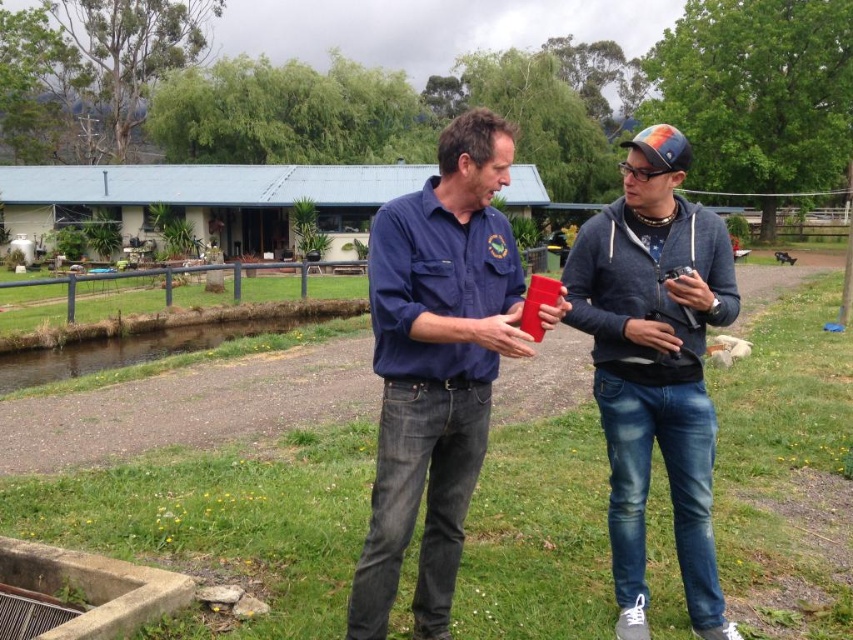
Which is in front, point (491, 157) or point (686, 465)?

Point (491, 157) is in front.

Is matte blue shirt at center positioned behind denim jeans at center?

That is False.

Where is `matte blue shirt at center`? matte blue shirt at center is located at coordinates (436, 365).